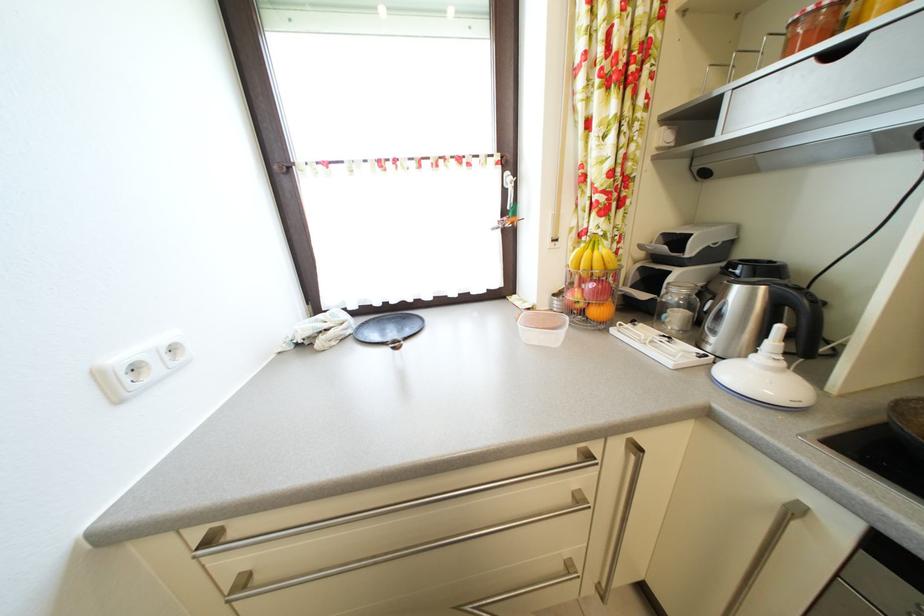
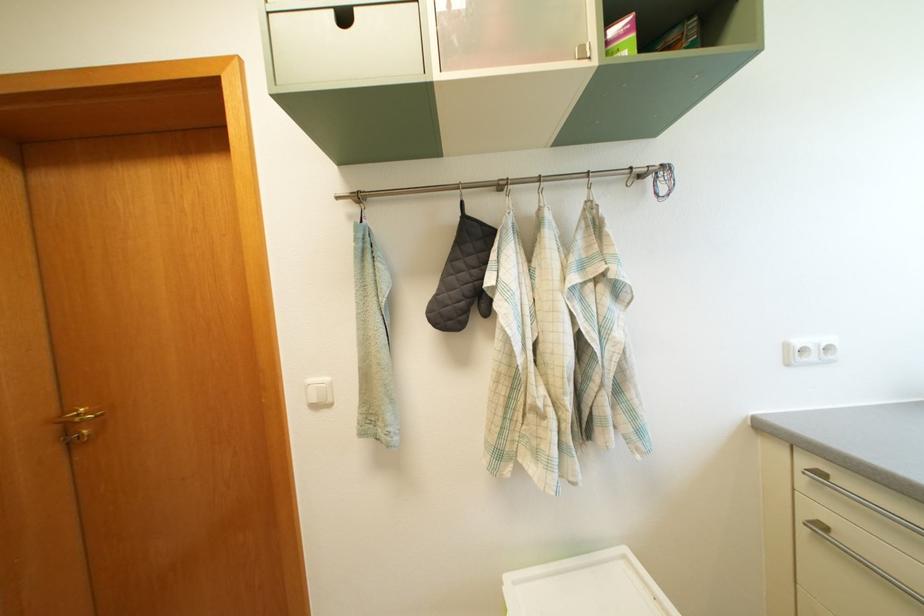
The point at (220, 546) is marked in the first image. Where is the corresponding point in the second image?

(827, 480)